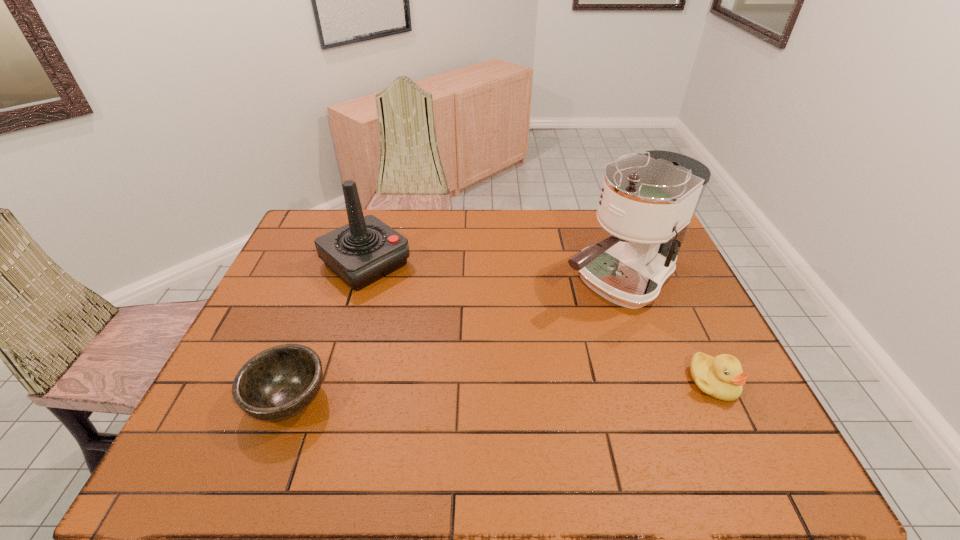
You are a GUI agent. You are given a task and a screenshot of the screen. Output one action in this format:
    pyautogui.click(x=<x>, y=<y>)
    Task: Click on the free space located 0.340m on the front-facing side of the tallest object
    
    Given the screenshot: What is the action you would take?
    pyautogui.click(x=480, y=362)

Where is `joystick located in the far edge section of the desktop`? The height and width of the screenshot is (540, 960). joystick located in the far edge section of the desktop is located at coordinates (365, 250).

Where is `coffee maker that is at the far edge`? The width and height of the screenshot is (960, 540). coffee maker that is at the far edge is located at coordinates (x=647, y=202).

Where is `bowl at the near edge`? The image size is (960, 540). bowl at the near edge is located at coordinates [278, 383].

Find the location of a particular element. duckling present at the near edge is located at coordinates [x=721, y=377].

At what (x,y) coordinates should I click in order to perform the action: click on bowl at the left edge. Please return your answer as a coordinate pair (x, y). Image resolution: width=960 pixels, height=540 pixels. Looking at the image, I should click on (278, 383).

Find the location of `joystick located at the left edge`. joystick located at the left edge is located at coordinates (365, 250).

At what (x,y) coordinates should I click in order to perform the action: click on duckling that is at the right edge. Please return your answer as a coordinate pair (x, y). Image resolution: width=960 pixels, height=540 pixels. Looking at the image, I should click on (721, 377).

Find the location of a particular element. The image size is (960, 540). coffee maker that is positioned at the right edge is located at coordinates (647, 202).

You are a GUI agent. You are given a task and a screenshot of the screen. Output one action in this format:
    pyautogui.click(x=<x>, y=<y>)
    Task: Click on the object situated at the far left corner
    Image resolution: width=960 pixels, height=540 pixels.
    Given the screenshot: What is the action you would take?
    pyautogui.click(x=365, y=250)